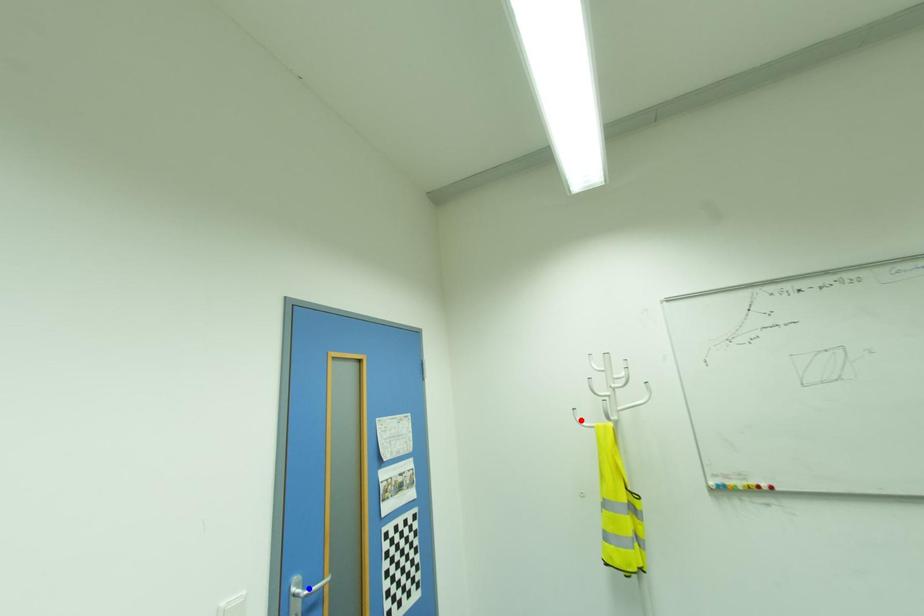
Question: In the image, two points are highlighted. Which point is nearer to the camera? Reply with the corresponding letter.

Choices:
 (A) blue point
 (B) red point

Answer: (A)